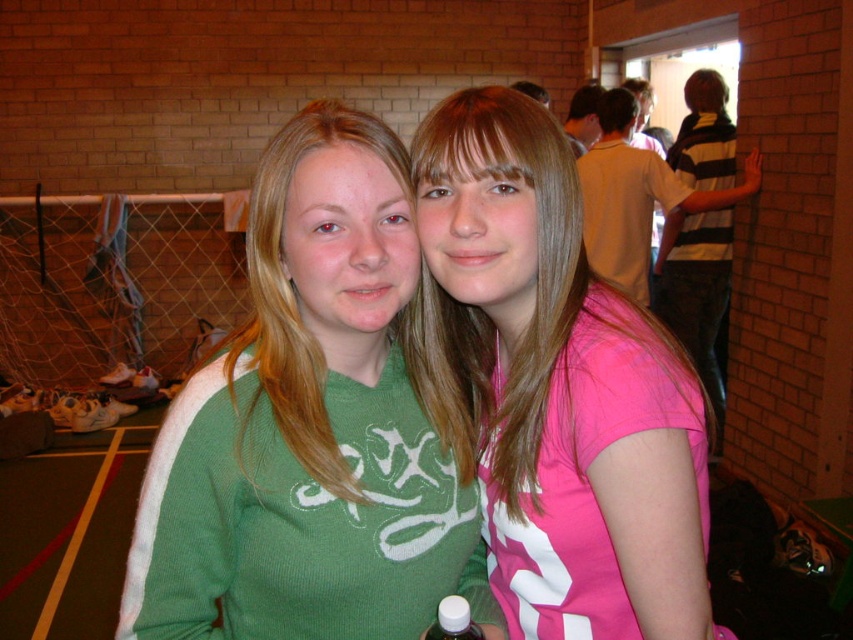
You are a photographer trying to capture a group photo of the two people in the center. Since you want to frame them symmetrically, you need to know their positions relative to each other. Which of the two, the green ribbed sweater at center or the pink matte shirt at center, is positioned to the left?

The green ribbed sweater at center is positioned to the left of the pink matte shirt at center.

You are organizing a clothing donation drive and need to determine if the green ribbed sweater at center and the yellow matte shirt at upper right can fit into a standard donation box that has a maximum capacity of 500 cubic inches. Given their sizes, will both items fit together?

The green ribbed sweater at center is smaller than the yellow matte shirt at upper right. However, without knowing their exact volumes, it is impossible to determine if both will fit into the donation box. More information about their individual sizes is needed.